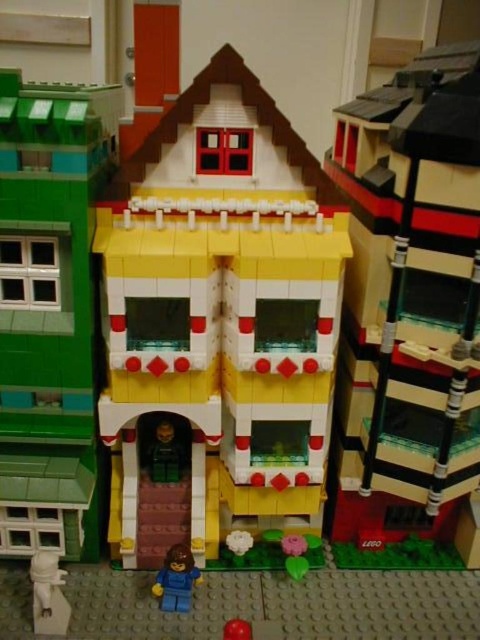
Looking at this image, does green matte building at left appear on the left side of white plastic minifigure at lower left?

Incorrect, green matte building at left is not on the left side of white plastic minifigure at lower left.

Does green matte building at left have a smaller size compared to white plastic minifigure at lower left?

Incorrect, green matte building at left is not smaller in size than white plastic minifigure at lower left.

At what (x,y) coordinates should I click in order to perform the action: click on green matte building at left. Please return your answer as a coordinate pair (x, y). Looking at the image, I should click on (50, 314).

Is yellow matte house at center positioned before white plastic minifigure at lower left?

Yes, yellow matte house at center is in front of white plastic minifigure at lower left.

Who is lower down, yellow matte house at center or white plastic minifigure at lower left?

white plastic minifigure at lower left is below.

Is point (228, 429) less distant than point (44, 582)?

No, it is not.

I want to click on yellow matte house at center, so click(220, 317).

Is blue plastic minifigure at lower center thinner than smooth red ball at lower center?

In fact, blue plastic minifigure at lower center might be wider than smooth red ball at lower center.

Who is taller, blue plastic minifigure at lower center or smooth red ball at lower center?

Standing taller between the two is blue plastic minifigure at lower center.

Where is `blue plastic minifigure at lower center`? The image size is (480, 640). blue plastic minifigure at lower center is located at coordinates (176, 579).